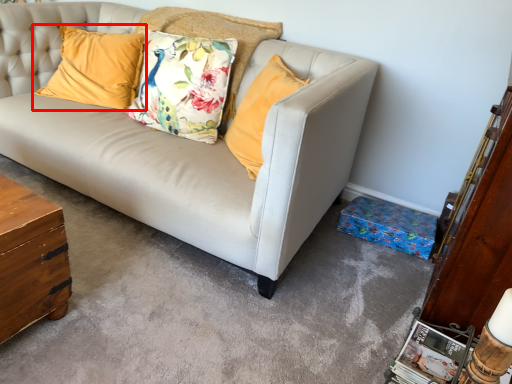
Question: From the image's perspective, where is pillow (annotated by the red box) located in relation to pillow in the image?

Choices:
 (A) above
 (B) below

Answer: (B)